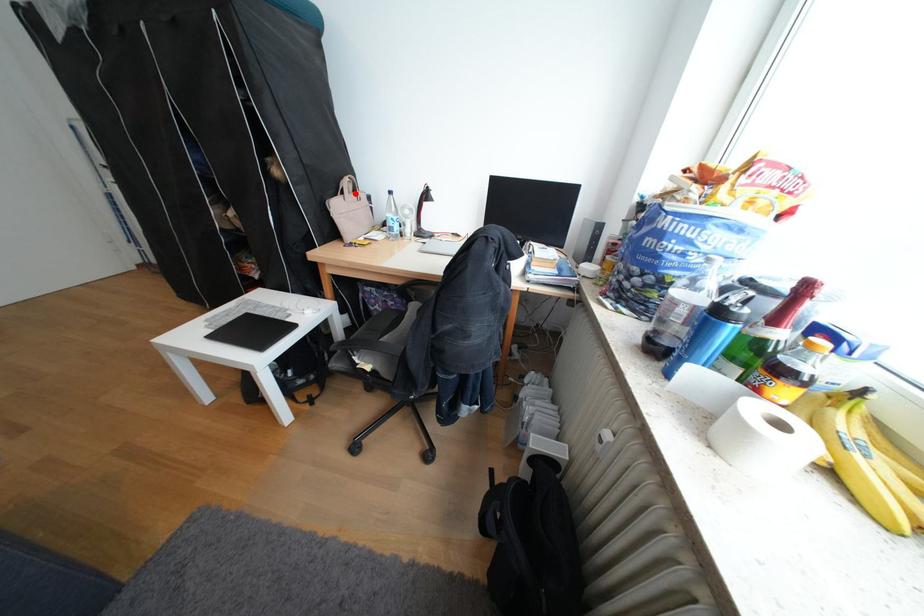
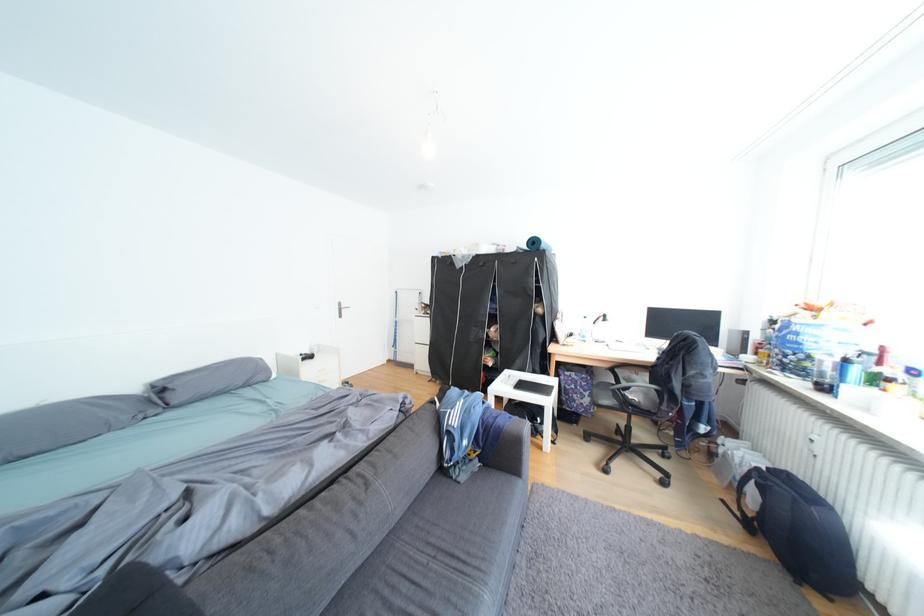
Question: I am providing you with two images of the same scene from different viewpoints. A red point is shown in image1. For the corresponding object point in image2, is it positioned nearer or farther from the camera?

Choices:
 (A) Nearer
 (B) Farther

Answer: (B)